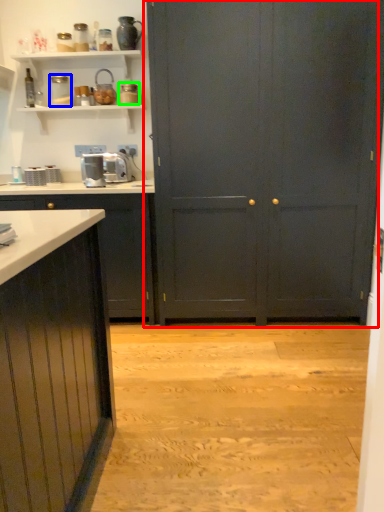
Question: Considering the real-world distances, which object is farthest from cupboard (highlighted by a red box)? appliance (highlighted by a blue box) or appliance (highlighted by a green box)?

Choices:
 (A) appliance
 (B) appliance

Answer: (A)